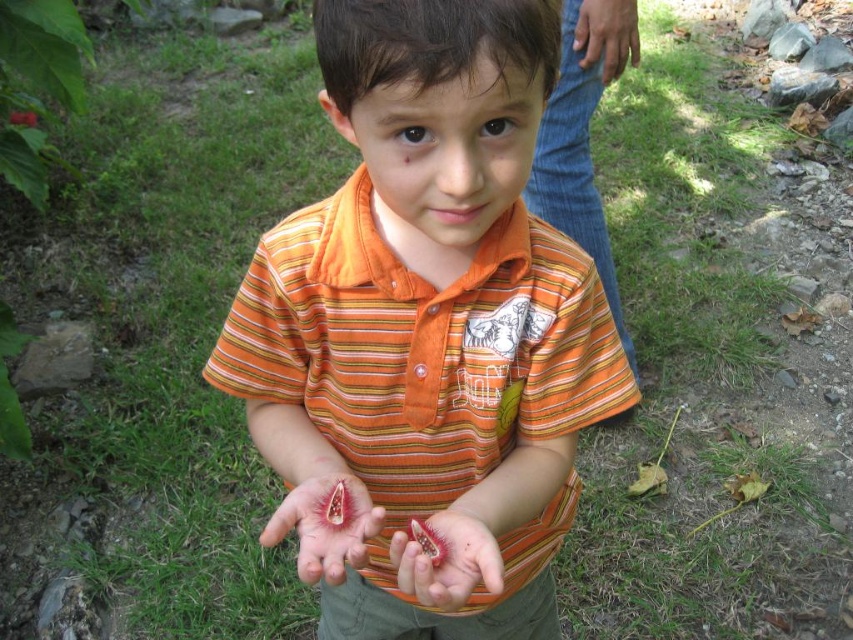
Is orange striped shirt at center to the left of fleshy pinkish-red at center from the viewer's perspective?

No, orange striped shirt at center is not to the left of fleshy pinkish-red at center.

Based on the photo, can you confirm if orange striped shirt at center is positioned below fleshy pinkish-red at center?

Correct, orange striped shirt at center is located below fleshy pinkish-red at center.

Who is more forward, (x=579, y=321) or (x=292, y=502)?

Point (x=292, y=502) is in front.

Image resolution: width=853 pixels, height=640 pixels. Identify the location of orange striped shirt at center. (424, 323).

Who is more forward, (279, 387) or (608, 26)?

Point (279, 387) is more forward.

Looking at this image, is orange striped shirt at center to the right of brown leather hand at upper right from the viewer's perspective?

No, orange striped shirt at center is not to the right of brown leather hand at upper right.

Looking at this image, who is more distant from viewer, (433, 429) or (602, 22)?

The point (602, 22) is more distant.

Where is `orange striped shirt at center`? orange striped shirt at center is located at coordinates (424, 323).

Is pink flesh at center shorter than brown leather hand at upper right?

Correct, pink flesh at center is not as tall as brown leather hand at upper right.

Which is below, pink flesh at center or brown leather hand at upper right?

Positioned lower is pink flesh at center.

From the picture: Who is more forward, (473, 584) or (631, 51)?

Positioned in front is point (473, 584).

This screenshot has width=853, height=640. I want to click on pink flesh at center, so click(451, 557).